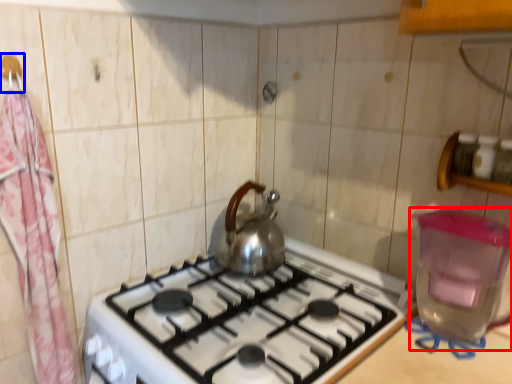
Question: Among these objects, which one is farthest to the camera, water heater (highlighted by a red box) or hanger (highlighted by a blue box)?

Choices:
 (A) water heater
 (B) hanger

Answer: (B)